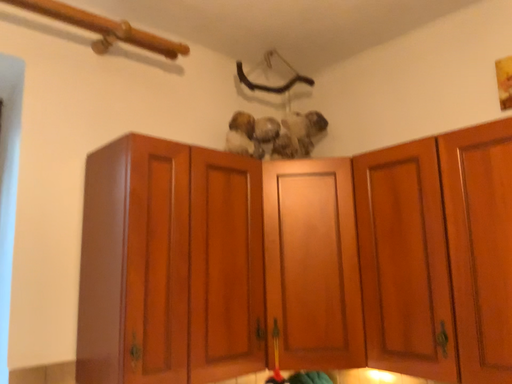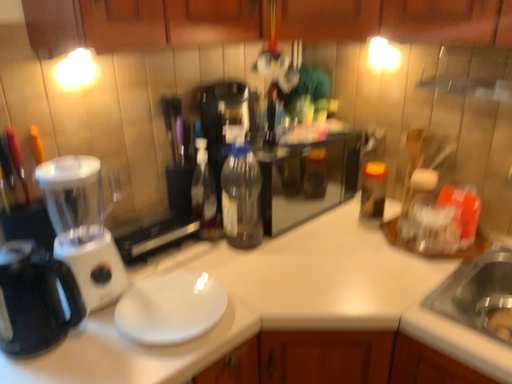
Question: How did the camera likely rotate when shooting the video?

Choices:
 (A) rotated upward
 (B) rotated downward

Answer: (B)